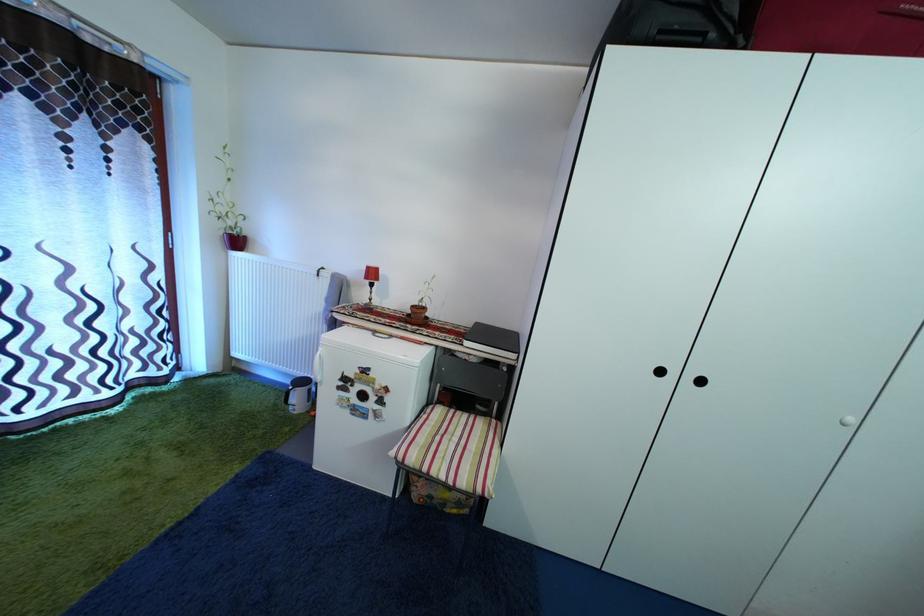
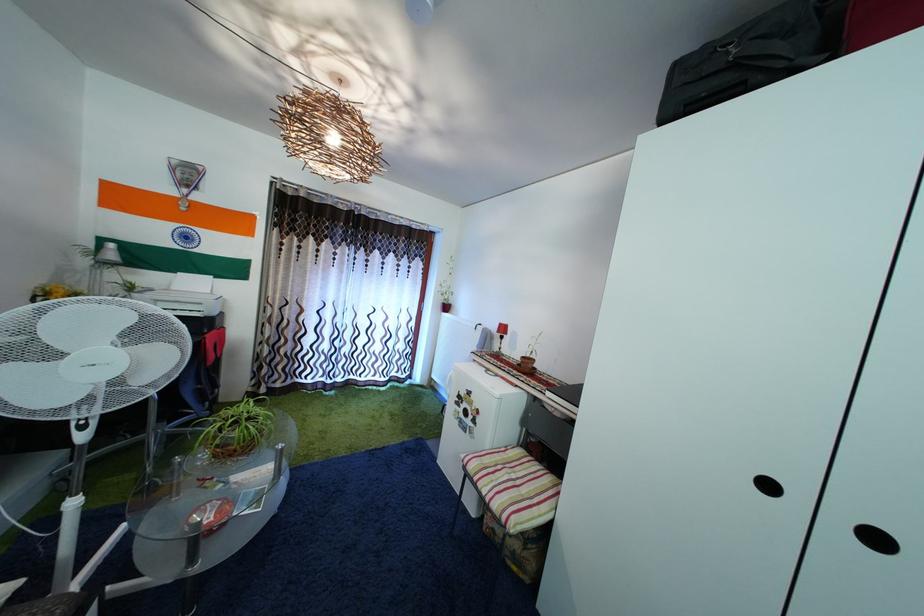
Locate, in the second image, the point that corresponds to (464,447) in the first image.

(521, 484)